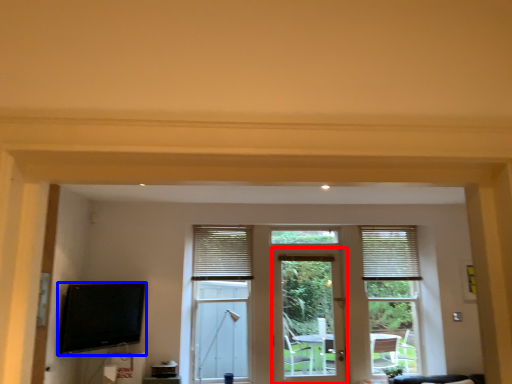
Question: Which of the following is the closest to the observer, door (highlighted by a red box) or television (highlighted by a blue box)?

Choices:
 (A) door
 (B) television

Answer: (B)